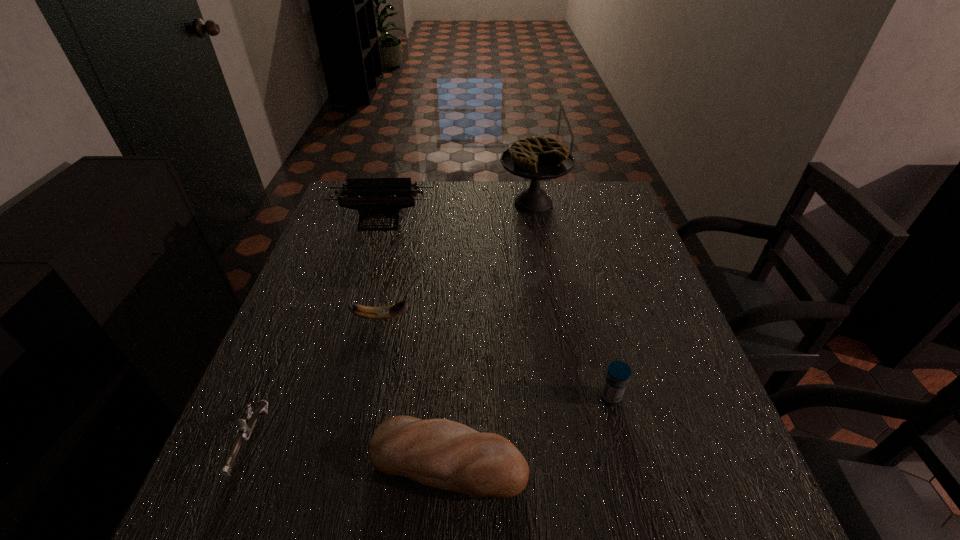
The height and width of the screenshot is (540, 960). Identify the location of free region located on the back of the bread. (452, 390).

You are a GUI agent. You are given a task and a screenshot of the screen. Output one action in this format:
    pyautogui.click(x=<x>, y=<y>)
    Task: Click on the pie that is at the far edge
    This screenshot has height=540, width=960.
    Given the screenshot: What is the action you would take?
    pyautogui.click(x=537, y=158)

Where is `typewriter that is at the far edge`? The image size is (960, 540). typewriter that is at the far edge is located at coordinates (374, 198).

Identify the location of bread located at the near edge. The image size is (960, 540). (440, 453).

This screenshot has height=540, width=960. I want to click on gun that is at the near edge, so click(x=245, y=426).

Identify the location of typewriter present at the left edge. This screenshot has height=540, width=960. (374, 198).

Find the location of `banana positioned at the left edge`. banana positioned at the left edge is located at coordinates (385, 312).

Identify the location of gun located in the left edge section of the desktop. (245, 426).

Image resolution: width=960 pixels, height=540 pixels. I want to click on object at the far left corner, so click(374, 198).

Where is `object positioned at the near left corner`? object positioned at the near left corner is located at coordinates (245, 426).